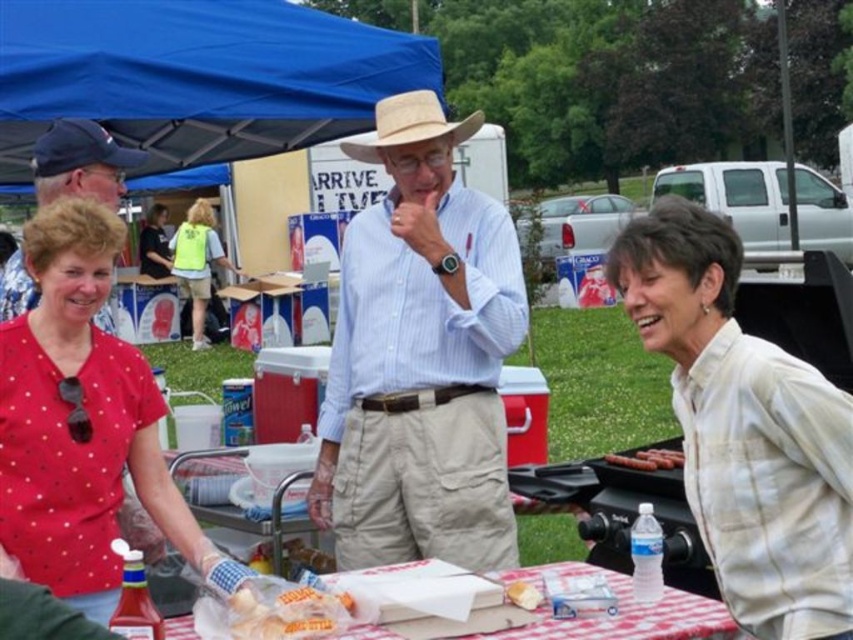
You are a photographer at the event and need to capture a closeup shot of the smooth brown hot dog at lower right without the white textured shirt at right appearing in the frame. Given their relative sizes, is this possible?

The white textured shirt at right is wider than the smooth brown hot dog at lower right, so adjusting the camera angle to focus solely on the smaller hot dog while excluding the larger shirt is feasible.

You are at a picnic and see both the golden bread at center and the white bread at center on the table. Which one is taller?

The golden bread at center is taller than the white bread at center.